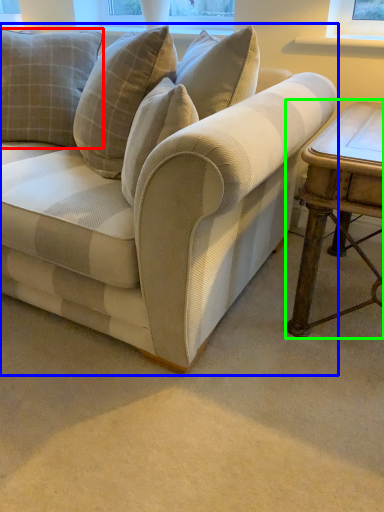
Question: Based on their relative distances, which object is nearer to pillow (highlighted by a red box)? Choose from studio couch (highlighted by a blue box) and table (highlighted by a green box).

Choices:
 (A) studio couch
 (B) table

Answer: (A)